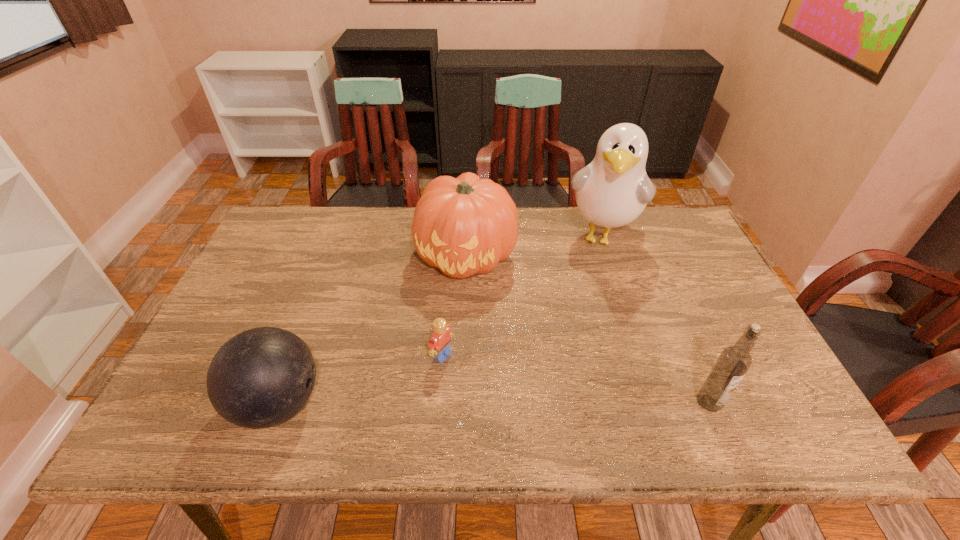
Image resolution: width=960 pixels, height=540 pixels. I want to click on object present at the left edge, so click(261, 377).

This screenshot has width=960, height=540. Identify the location of object present at the right edge. (734, 361).

Image resolution: width=960 pixels, height=540 pixels. Identify the location of object present at the near left corner. (261, 377).

Find the location of `object located at the near right corner`. object located at the near right corner is located at coordinates (734, 361).

The height and width of the screenshot is (540, 960). I want to click on free region at the far edge of the desktop, so click(612, 235).

In the image, there is a desktop. At what (x,y) coordinates should I click in order to perform the action: click on vacant space at the near edge. Please return your answer as a coordinate pair (x, y). Looking at the image, I should click on (540, 386).

Where is `vacant space at the left edge of the desktop`? Image resolution: width=960 pixels, height=540 pixels. vacant space at the left edge of the desktop is located at coordinates (288, 294).

In order to click on vacant space at the right edge of the desktop in this screenshot , I will do `click(687, 300)`.

Identify the location of vacant region at the far left corner of the desktop. (298, 238).

You are a GUI agent. You are given a task and a screenshot of the screen. Output one action in this format:
    pyautogui.click(x=<x>, y=<y>)
    Task: Click on the vacant area between the Lego and the tallest object
    
    Given the screenshot: What is the action you would take?
    pyautogui.click(x=521, y=296)